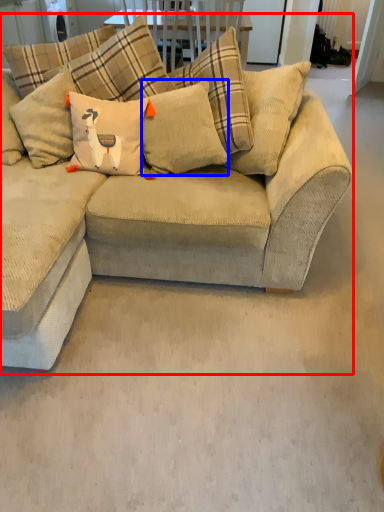
Question: Which of the following is the closest to the observer, studio couch (highlighted by a red box) or pillow (highlighted by a blue box)?

Choices:
 (A) studio couch
 (B) pillow

Answer: (A)